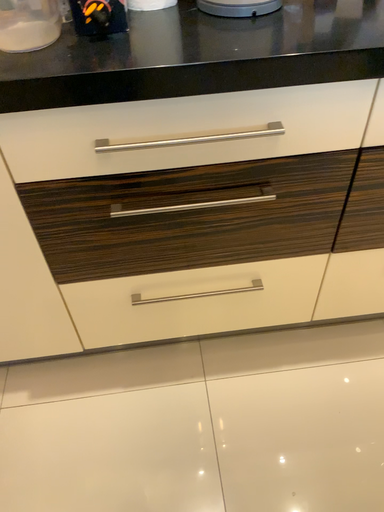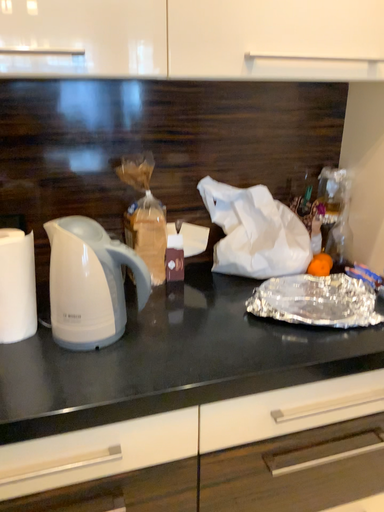
Question: How did the camera likely rotate when shooting the video?

Choices:
 (A) rotated left
 (B) rotated right

Answer: (B)